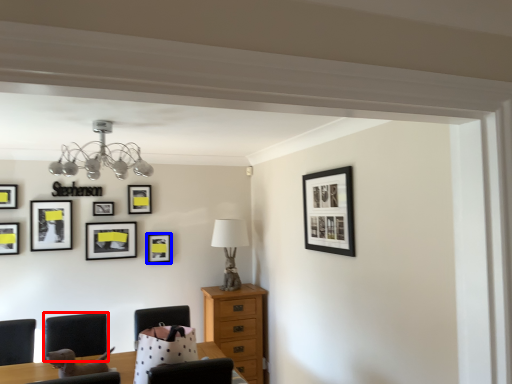
Question: Which object is further to the camera taking this photo, armchair (highlighted by a red box) or picture frame (highlighted by a blue box)?

Choices:
 (A) armchair
 (B) picture frame

Answer: (B)